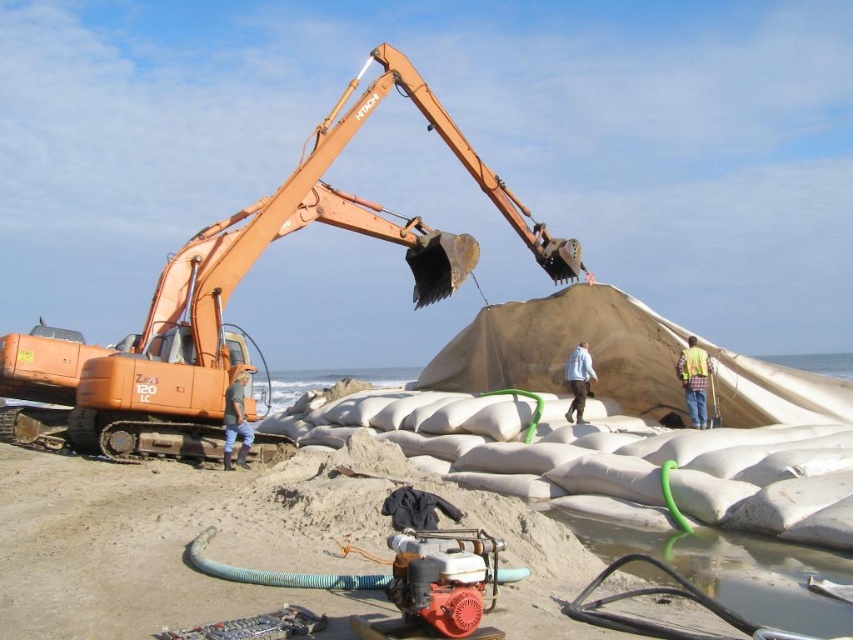
Is orange metallic excavator at left to the left of yellow reflective vest at center from the viewer's perspective?

Indeed, orange metallic excavator at left is positioned on the left side of yellow reflective vest at center.

Can you confirm if orange metallic excavator at left is smaller than yellow reflective vest at center?

Incorrect, orange metallic excavator at left is not smaller in size than yellow reflective vest at center.

Which is behind, point (22, 424) or point (700, 369)?

Positioned behind is point (22, 424).

You are a GUI agent. You are given a task and a screenshot of the screen. Output one action in this format:
    pyautogui.click(x=<x>, y=<y>)
    Task: Click on the orange metallic excavator at left
    The image size is (853, 640).
    Given the screenshot: What is the action you would take?
    pyautogui.click(x=230, y=292)

This screenshot has height=640, width=853. What do you see at coordinates (218, 534) in the screenshot?
I see `beige sandbags at center` at bounding box center [218, 534].

Can you confirm if beige sandbags at center is thinner than blue denim jacket at center?

Incorrect, beige sandbags at center's width is not less than blue denim jacket at center's.

Locate an element on the screen. beige sandbags at center is located at coordinates (218, 534).

Locate an element on the screen. beige sandbags at center is located at coordinates (x=218, y=534).

Is green rubber boots at lower center smaller than blue denim jacket at center?

Yes, green rubber boots at lower center is smaller than blue denim jacket at center.

Can you confirm if green rubber boots at lower center is positioned below blue denim jacket at center?

Yes, green rubber boots at lower center is below blue denim jacket at center.

Is point (241, 426) closer to camera compared to point (589, 384)?

Yes, it is.

This screenshot has width=853, height=640. Find the location of `green rubber boots at lower center`. green rubber boots at lower center is located at coordinates (236, 420).